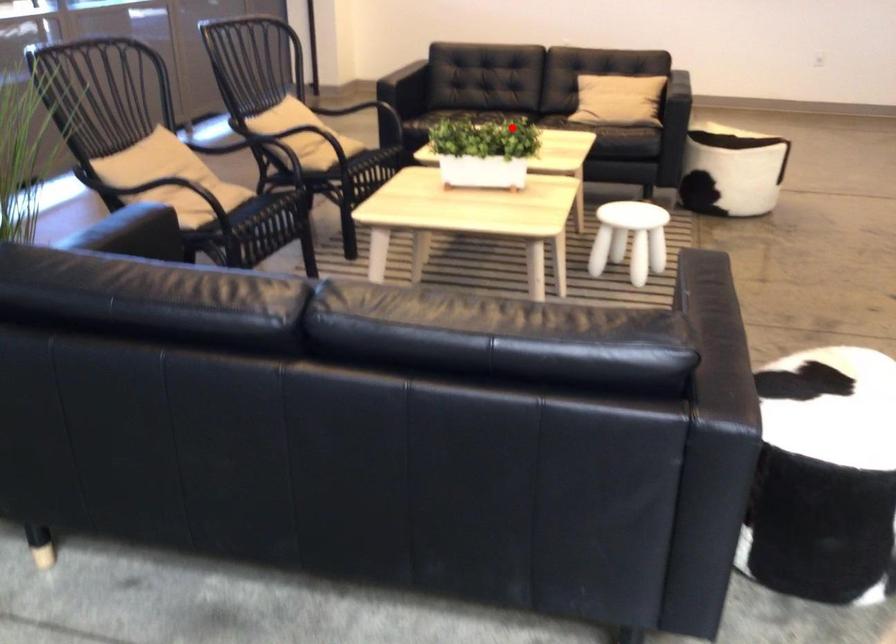
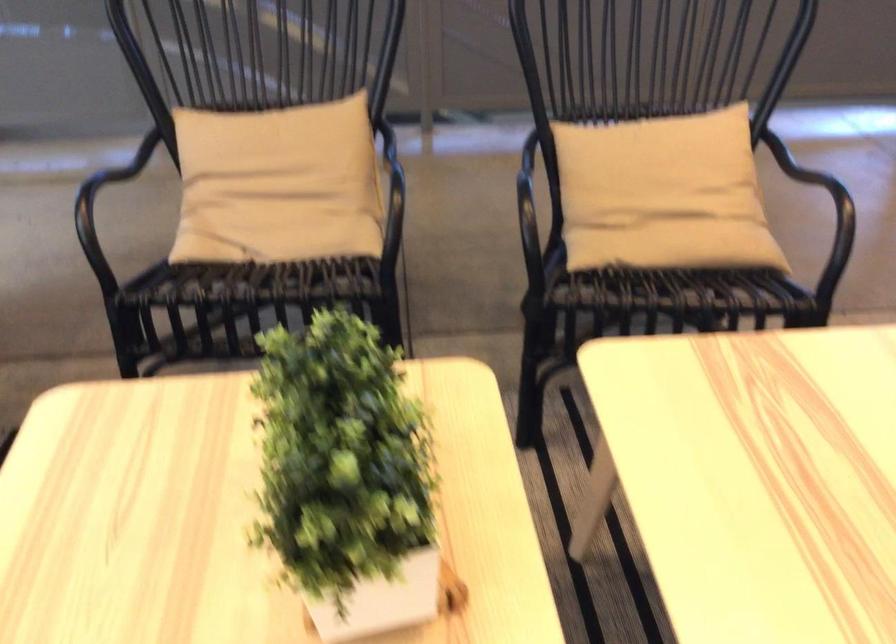
Question: I am providing you with two images of the same scene from different viewpoints. Image1 has a red point marked. In image2, the corresponding 3D location appears at what relative position? Reply with the corresponding letter.

Choices:
 (A) Closer
 (B) Farther

Answer: (A)